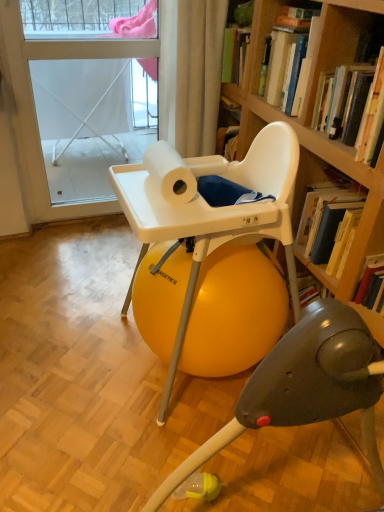
Question: Should I look upward or downward to see white fabric screen door at upper left?

Choices:
 (A) down
 (B) up

Answer: (B)

Question: Is the position of hardcover book at upper right, the 2th book from the front, more distant than that of white plastic highchair at center?

Choices:
 (A) no
 (B) yes

Answer: (B)

Question: Is hardcover book at upper right, the 2th book from the front, wider than white plastic highchair at center?

Choices:
 (A) yes
 (B) no

Answer: (B)

Question: Considering the relative sizes of hardcover book at upper right, which is the 1th book from back to front, and white plastic highchair at center in the image provided, is hardcover book at upper right, which is the 1th book from back to front, shorter than white plastic highchair at center?

Choices:
 (A) yes
 (B) no

Answer: (A)

Question: Could white plastic highchair at center be considered to be inside hardcover book at upper right, which is the 1th book from back to front?

Choices:
 (A) no
 (B) yes

Answer: (A)

Question: Is hardcover book at upper right, the 2th book from the front, at the left side of white plastic highchair at center?

Choices:
 (A) no
 (B) yes

Answer: (A)

Question: Is hardcover book at upper right, the 2th book from the front, far from white plastic highchair at center?

Choices:
 (A) yes
 (B) no

Answer: (B)

Question: Is the depth of hardcover book at upper right, the 2th book from the front, less than that of white matte paper towel at center?

Choices:
 (A) no
 (B) yes

Answer: (A)

Question: Is hardcover book at upper right, which is the 1th book from back to front, positioned with its back to white matte paper towel at center?

Choices:
 (A) yes
 (B) no

Answer: (B)

Question: Considering the relative positions of hardcover book at upper right, the 2th book from the front, and white matte paper towel at center in the image provided, is hardcover book at upper right, the 2th book from the front, to the left of white matte paper towel at center from the viewer's perspective?

Choices:
 (A) no
 (B) yes

Answer: (A)

Question: Is hardcover book at upper right, the 2th book from the front, to the right of white matte paper towel at center from the viewer's perspective?

Choices:
 (A) yes
 (B) no

Answer: (A)

Question: Can you confirm if hardcover book at upper right, which is the 1th book from back to front, is thinner than white matte paper towel at center?

Choices:
 (A) yes
 (B) no

Answer: (B)

Question: Is hardcover book at upper right, the 2th book from the front, taller than white matte paper towel at center?

Choices:
 (A) yes
 (B) no

Answer: (A)

Question: Can you confirm if white plastic highchair at center is wider than hardcover book at upper right, which is the 1th book from back to front?

Choices:
 (A) yes
 (B) no

Answer: (A)